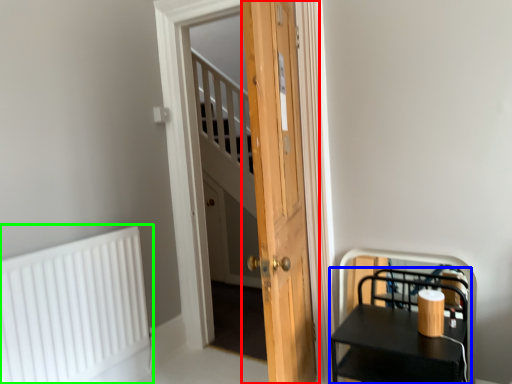
Question: Considering the real-world distances, which object is farthest from door (highlighted by a red box)? furniture (highlighted by a blue box) or radiator (highlighted by a green box)?

Choices:
 (A) furniture
 (B) radiator

Answer: (B)